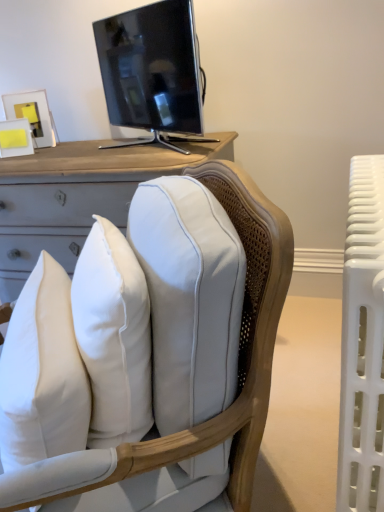
Question: Should I look upward or downward to see white leather chair at center?

Choices:
 (A) up
 (B) down

Answer: (B)

Question: Is the position of white soft pillow at center more distant than that of white plastic radiator at right?

Choices:
 (A) yes
 (B) no

Answer: (A)

Question: Is white soft pillow at center bigger than white plastic radiator at right?

Choices:
 (A) yes
 (B) no

Answer: (B)

Question: Is white soft pillow at center far from white plastic radiator at right?

Choices:
 (A) no
 (B) yes

Answer: (A)

Question: Considering the relative sizes of white soft pillow at center and white plastic radiator at right in the image provided, is white soft pillow at center shorter than white plastic radiator at right?

Choices:
 (A) no
 (B) yes

Answer: (B)

Question: Is white soft pillow at center aimed at white plastic radiator at right?

Choices:
 (A) yes
 (B) no

Answer: (B)

Question: From the image's perspective, is white soft pillow at center under white plastic radiator at right?

Choices:
 (A) no
 (B) yes

Answer: (B)

Question: Is white soft pillow at center to the left of matte black tv at upper center from the viewer's perspective?

Choices:
 (A) yes
 (B) no

Answer: (A)

Question: Is white soft pillow at center aimed at matte black tv at upper center?

Choices:
 (A) no
 (B) yes

Answer: (A)

Question: From the image's perspective, is white soft pillow at center located beneath matte black tv at upper center?

Choices:
 (A) yes
 (B) no

Answer: (A)

Question: Is white soft pillow at center in contact with matte black tv at upper center?

Choices:
 (A) yes
 (B) no

Answer: (B)

Question: From a real-world perspective, is white soft pillow at center under matte black tv at upper center?

Choices:
 (A) no
 (B) yes

Answer: (B)

Question: From the image's perspective, is white soft pillow at center on matte black tv at upper center?

Choices:
 (A) yes
 (B) no

Answer: (B)

Question: Is matte black tv at upper center facing away from white soft pillow at center?

Choices:
 (A) no
 (B) yes

Answer: (A)